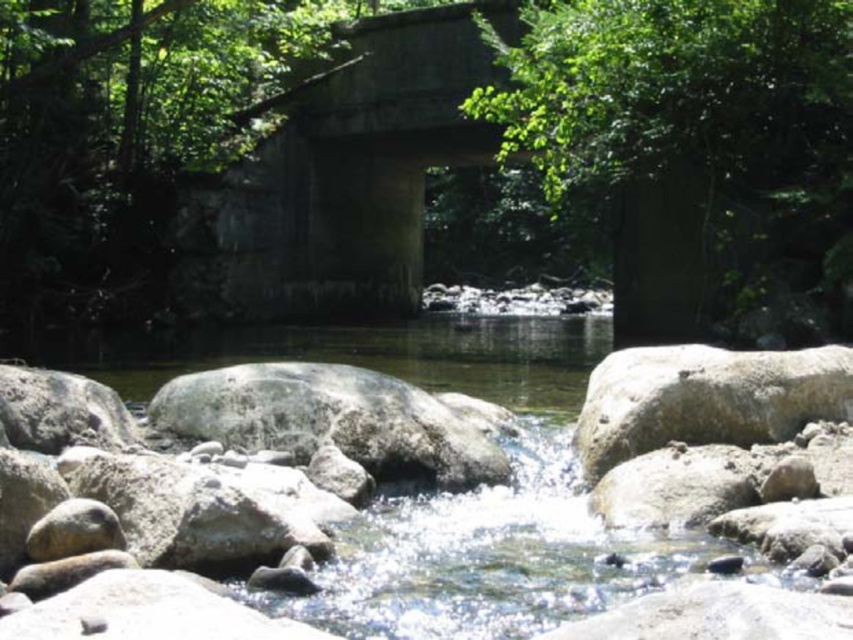
Is green leafy tree at center thinner than gray rough boulder at right?

No, green leafy tree at center is not thinner than gray rough boulder at right.

Which is below, green leafy tree at center or gray rough boulder at right?

Positioned lower is gray rough boulder at right.

Where is `green leafy tree at center`? This screenshot has width=853, height=640. green leafy tree at center is located at coordinates (679, 120).